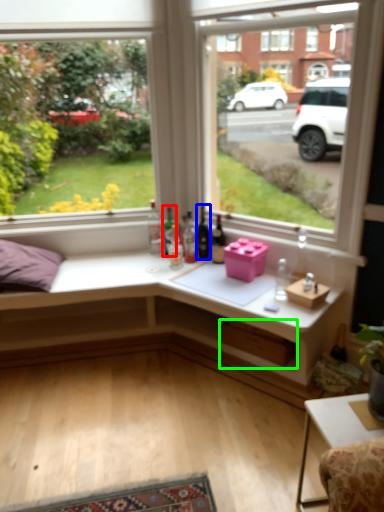
Question: Based on their relative distances, which object is farther from bottle (highlighted by a red box)? Choose from bottle (highlighted by a blue box) and window box (highlighted by a green box).

Choices:
 (A) bottle
 (B) window box

Answer: (B)